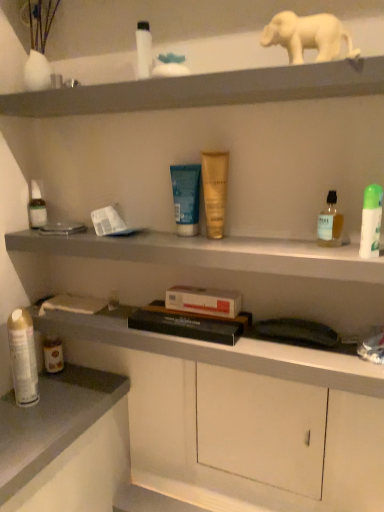
The height and width of the screenshot is (512, 384). I want to click on vacant space to the left of clear glass bottle at upper right, placed as the second toiletry when sorted from right to left, so click(x=238, y=243).